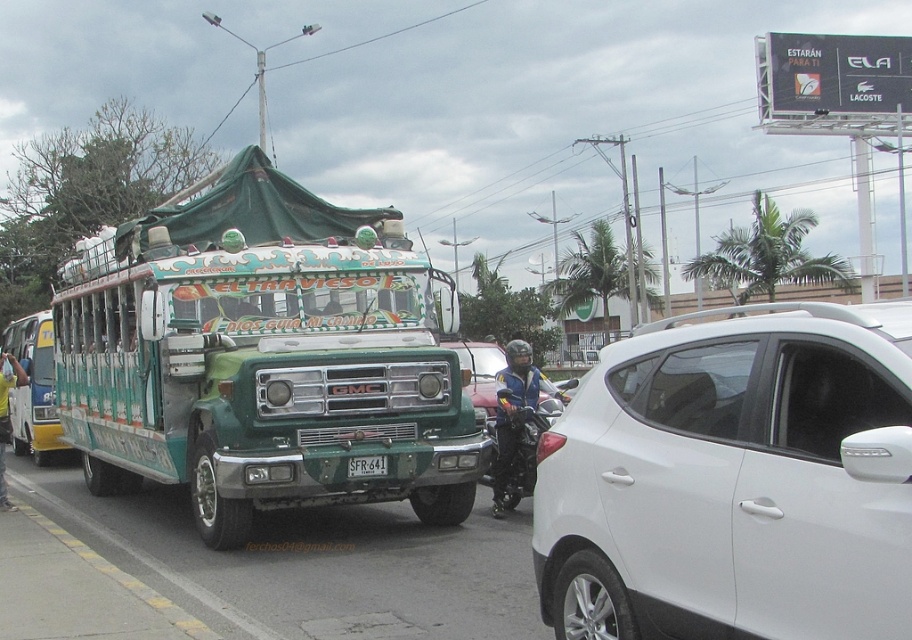
You are a delivery person needing to pass between the white matte motorcycle at center and the yellow fabric shirt at left. Which object is closer to the ground?

The white matte motorcycle at center is shorter than the yellow fabric shirt at left, so the white matte motorcycle at center is closer to the ground.

You are a pedestrian standing on the sidewalk and see the white matte motorcycle at center and the yellow fabric shirt at left. Which object is nearer to you?

The white matte motorcycle at center is closer to the viewer than the yellow fabric shirt at left.

You are a pedestrian standing at the edge of the street where the green matte bus at center and the white matte motorcycle at center are located. You want to cross the street to the other side. Considering the distance between them, do you think there is enough space to safely cross between the two vehicles?

The green matte bus at center is 12.97 feet away from the white matte motorcycle at center. Since the distance between them is over 12 feet, there should be enough space to safely cross between the two vehicles as a pedestrian.